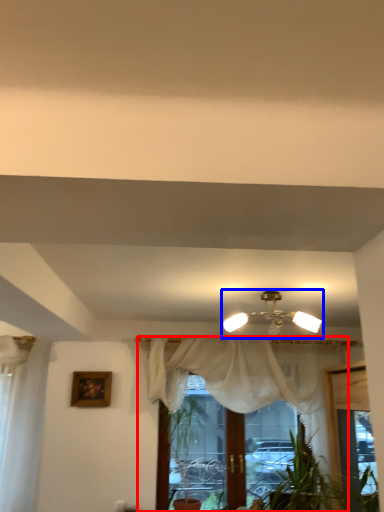
Question: Among these objects, which one is nearest to the camera, curtain (highlighted by a red box) or lamp (highlighted by a blue box)?

Choices:
 (A) curtain
 (B) lamp

Answer: (B)